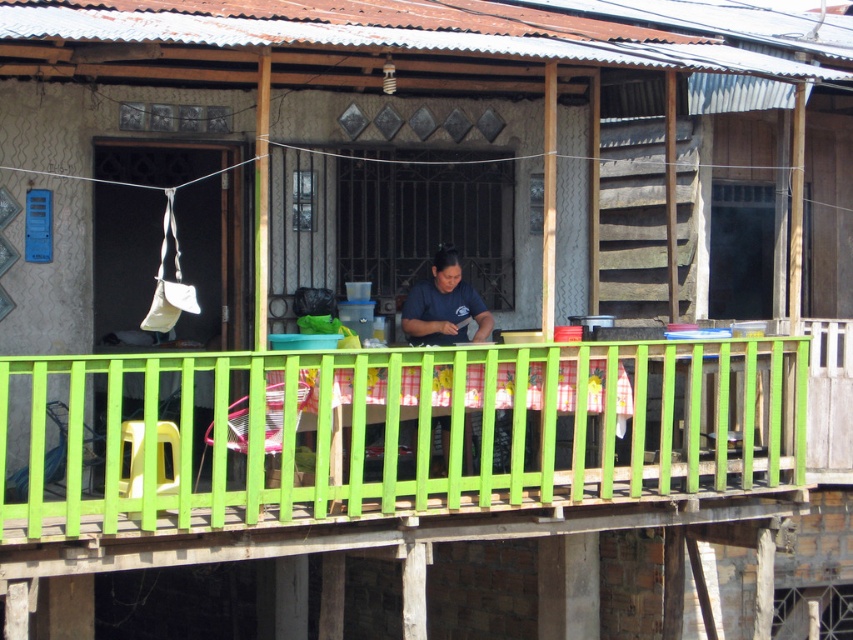
Who is positioned more to the right, green plastic balustrade at center or dark blue shirt at center?

dark blue shirt at center

Does green plastic balustrade at center have a larger size compared to dark blue shirt at center?

Yes, green plastic balustrade at center is bigger than dark blue shirt at center.

The image size is (853, 640). I want to click on green plastic balustrade at center, so click(390, 429).

In order to click on green plastic balustrade at center in this screenshot , I will do `click(390, 429)`.